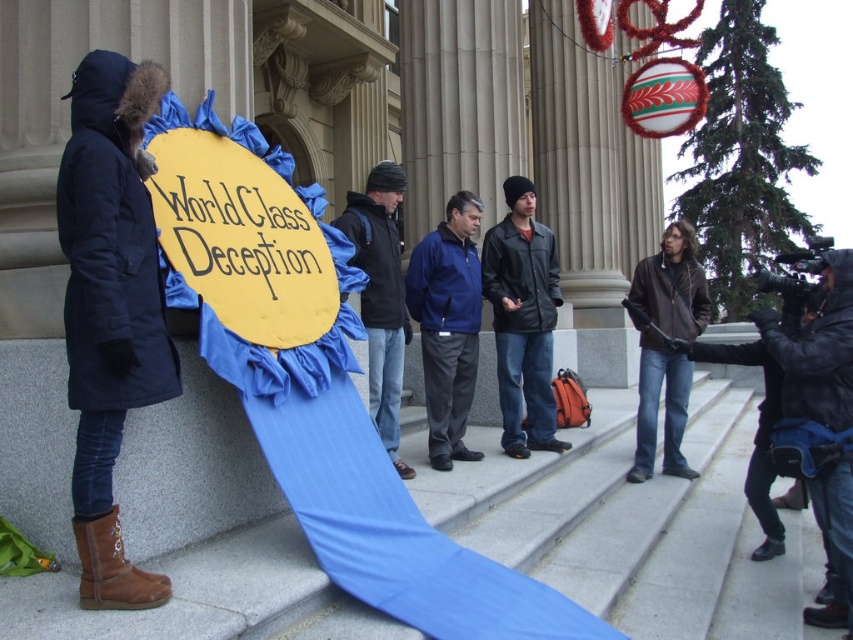
Who is positioned more to the left, leather jacket at center or brown leather jacket at right?

From the viewer's perspective, leather jacket at center appears more on the left side.

The width and height of the screenshot is (853, 640). Find the location of `leather jacket at center`. leather jacket at center is located at coordinates (523, 320).

Locate an element on the screen. leather jacket at center is located at coordinates (523, 320).

The image size is (853, 640). Identify the location of blue fabric sign at center. (447, 324).

The image size is (853, 640). Describe the element at coordinates (447, 324) in the screenshot. I see `blue fabric sign at center` at that location.

Locate an element on the screen. The image size is (853, 640). blue fabric sign at center is located at coordinates (447, 324).

Which is more to the left, black leather jacket at right or brown leather jacket at right?

Positioned to the left is brown leather jacket at right.

Find the location of a particular element. The height and width of the screenshot is (640, 853). black leather jacket at right is located at coordinates (819, 420).